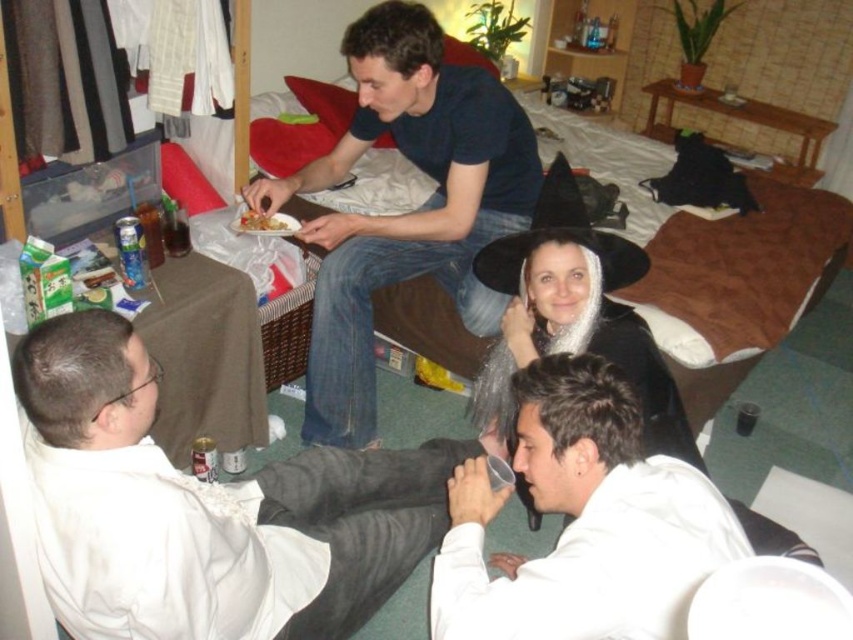
You are standing in the room and want to reach both the point at (328, 509) and the point at (709, 538). Which point is closer to you?

The point at (328, 509) is closer to you because it is further to the viewer than the point at (709, 538).